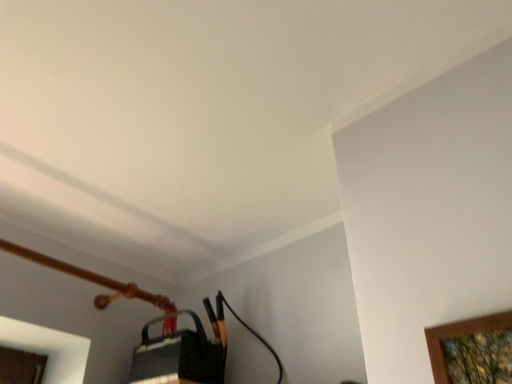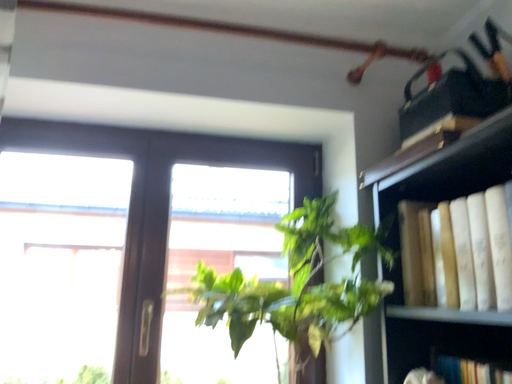
Question: How did the camera likely rotate when shooting the video?

Choices:
 (A) rotated left
 (B) rotated right

Answer: (A)